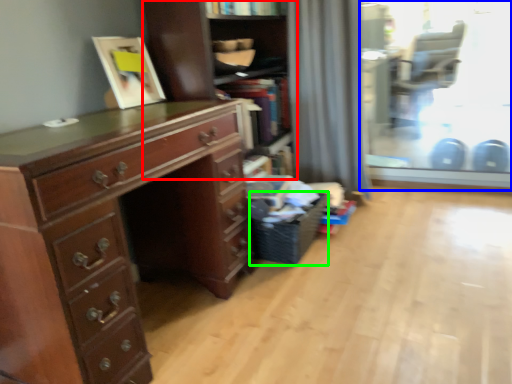
Question: Which object is positioned closest to shelf (highlighted by a red box)? Select from glass door (highlighted by a blue box) and laundry basket (highlighted by a green box).

Choices:
 (A) glass door
 (B) laundry basket

Answer: (B)